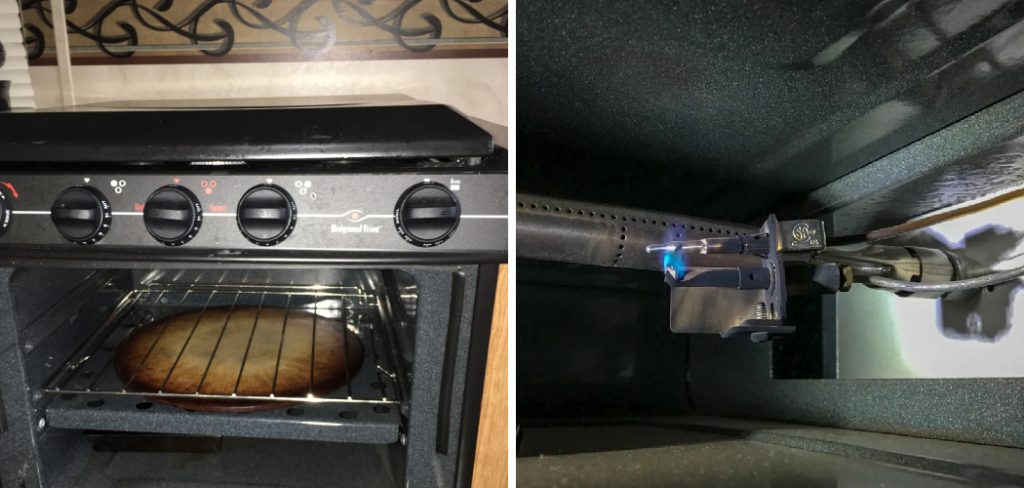
Locate an element on the screen. shelf is located at coordinates (151, 380).